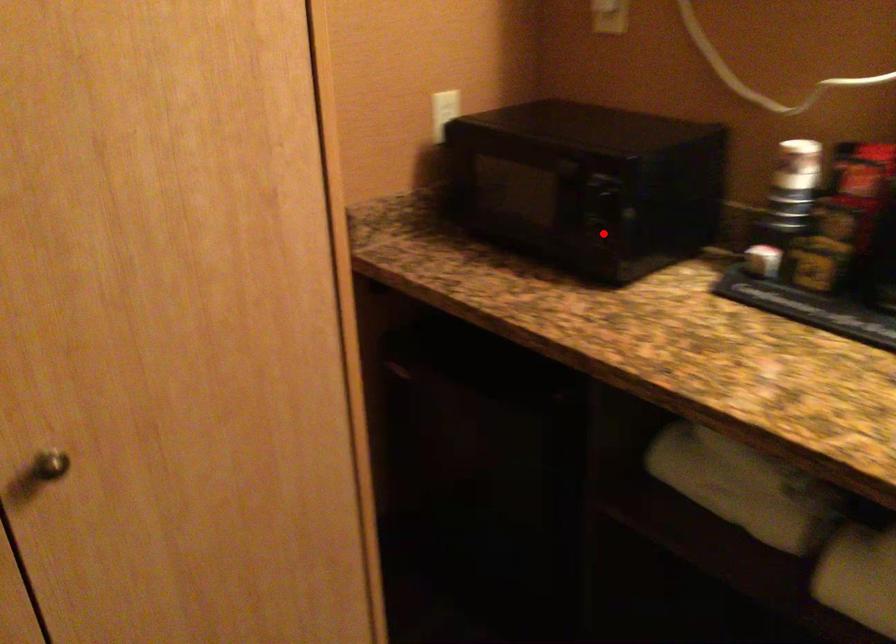
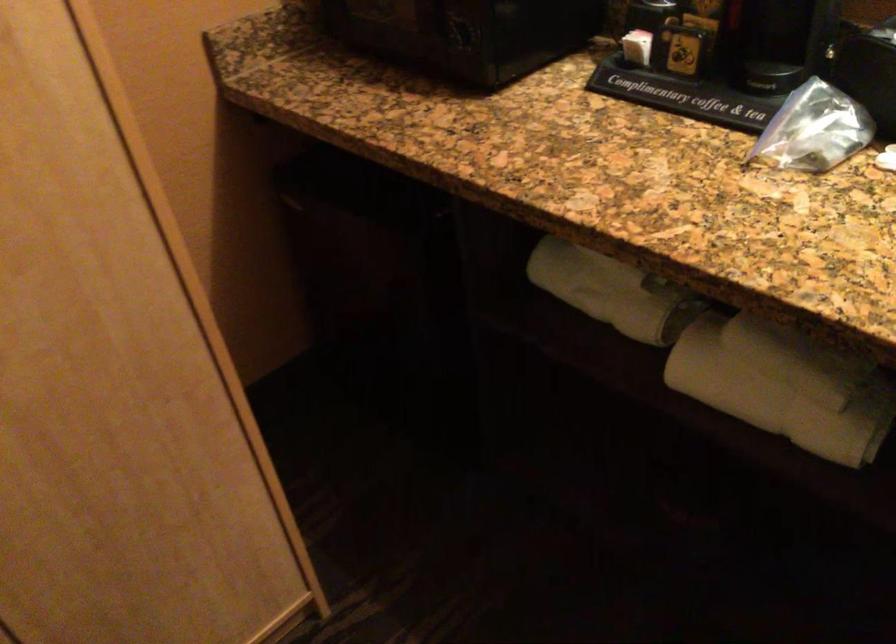
Locate, in the second image, the point that corresponds to the highlighted location in the first image.

(466, 33)